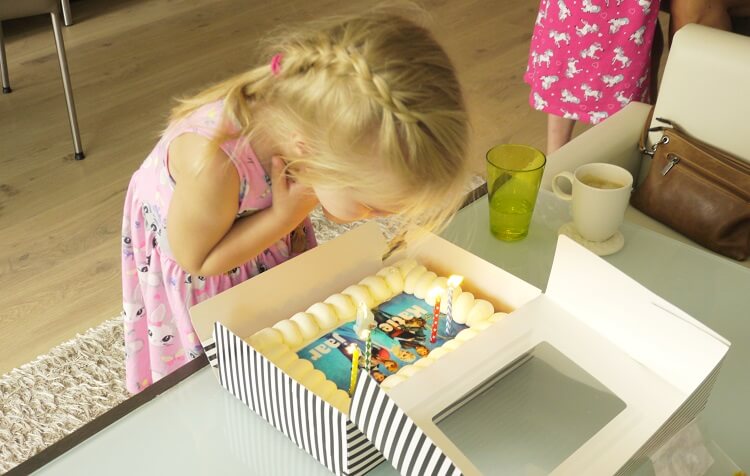
Where is `yellow drinking gllass`? yellow drinking gllass is located at coordinates (502, 199).